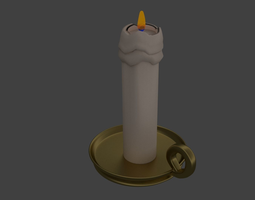
You are a GUI agent. You are given a task and a screenshot of the screen. Output one action in this format:
    pyautogui.click(x=<x>, y=<y>)
    Task: Click on the reflection on candle holder
    This screenshot has height=200, width=255.
    Given the screenshot: What is the action you would take?
    pyautogui.click(x=97, y=142), pyautogui.click(x=193, y=159), pyautogui.click(x=174, y=162), pyautogui.click(x=129, y=182)